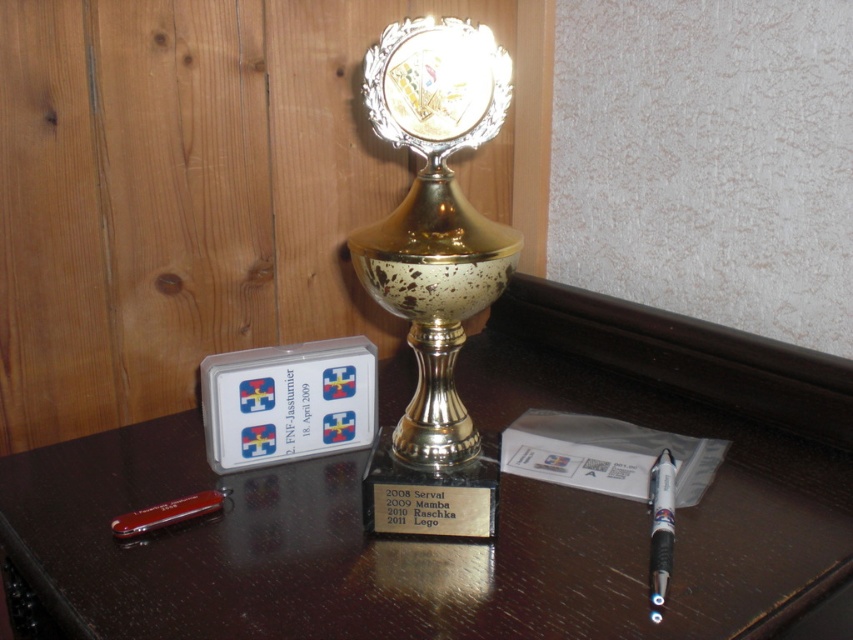
Between black plastic pen at lower right and red plastic pen at lower left, which one appears on the left side from the viewer's perspective?

red plastic pen at lower left is more to the left.

Identify the location of black plastic pen at lower right. (660, 529).

Is point (666, 454) closer to camera compared to point (218, 493)?

No, (666, 454) is further to viewer.

The width and height of the screenshot is (853, 640). In order to click on black plastic pen at lower right in this screenshot , I will do `click(660, 529)`.

Measure the distance from gold polished trophy at center to red plastic pen at lower left.

gold polished trophy at center is 12.42 inches from red plastic pen at lower left.

Does gold polished trophy at center appear on the right side of red plastic pen at lower left?

Correct, you'll find gold polished trophy at center to the right of red plastic pen at lower left.

Is point (383, 131) behind point (114, 518)?

No, (383, 131) is in front of (114, 518).

At what (x,y) coordinates should I click in order to perform the action: click on gold polished trophy at center. Please return your answer as a coordinate pair (x, y). Image resolution: width=853 pixels, height=640 pixels. Looking at the image, I should click on (434, 216).

Who is shorter, shiny dark wood table at center or gold polished trophy at center?

shiny dark wood table at center

Is shiny dark wood table at center further to camera compared to gold polished trophy at center?

No, shiny dark wood table at center is closer to the viewer.

Measure the distance between shiny dark wood table at center and camera.

shiny dark wood table at center is 24.12 inches from camera.

This screenshot has width=853, height=640. Identify the location of shiny dark wood table at center. (430, 540).